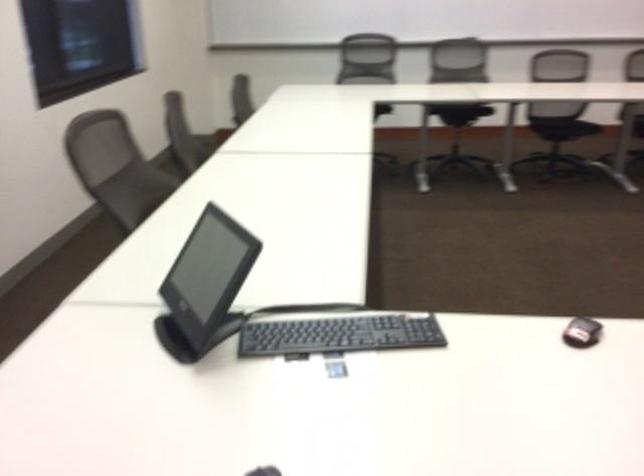
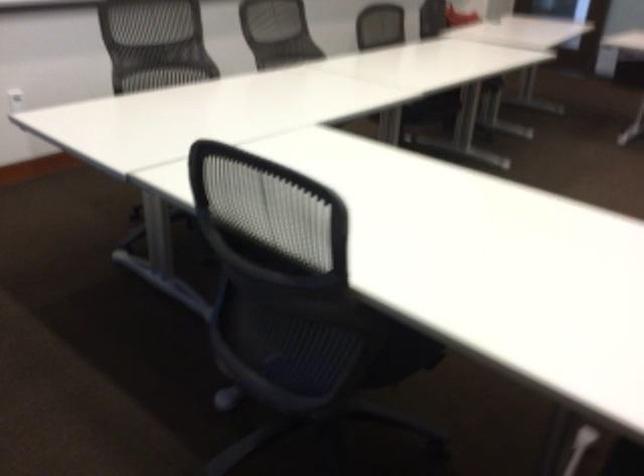
Question: In a continuous first-person perspective shot, in which direction is the camera moving?

Choices:
 (A) Left
 (B) Right
 (C) Forward
 (D) Backward

Answer: (D)